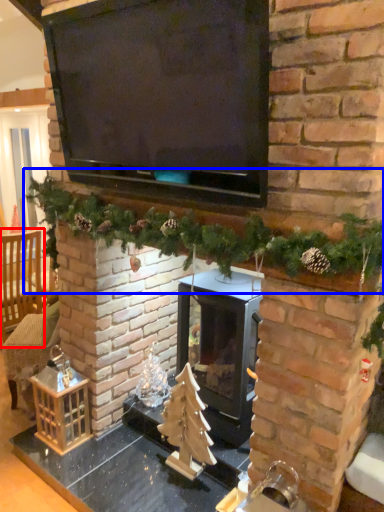
Question: Among these objects, which one is nearest to the camera, armchair (highlighted by a red box) or christmas decoration (highlighted by a blue box)?

Choices:
 (A) armchair
 (B) christmas decoration

Answer: (B)